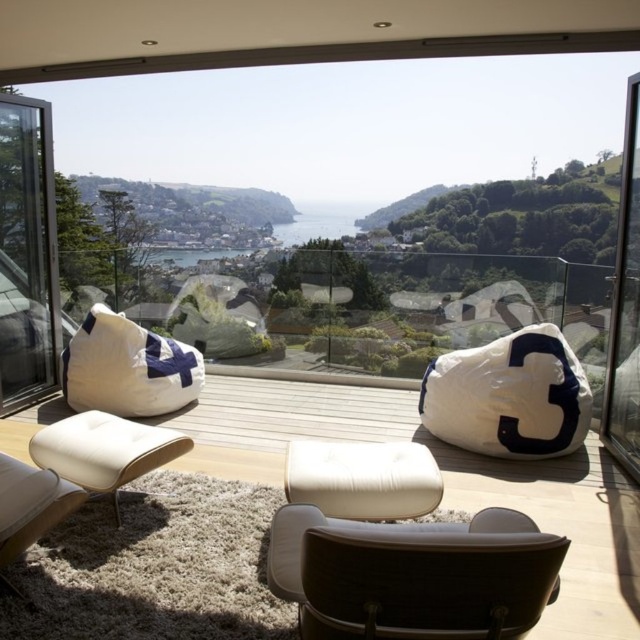
You are standing in the living room and want to walk towards the two points marked in the image. Which point, point (20, 204) or point (636, 88), will you reach first?

You will reach point (20, 204) first because it is closer to you than point (636, 88), which is further away.

From the picture: You are a delivery person carrying a large sofa that is 5 meters long. You need to bring it through the transparent glass window at center into the living room. Can you fit the sofa through the window?

The sofa is 5 meters long, and the transparent glass window at center is 5.70 meters apart. The sofa can fit through the window since it is shorter than the window height.

You are standing in the living room and want to look outside through the transparent glass window at center. Where should you position yourself to have the best view?

The transparent glass window at center is located at point [349,195], so you should position yourself directly in front of that coordinate to have the best view.